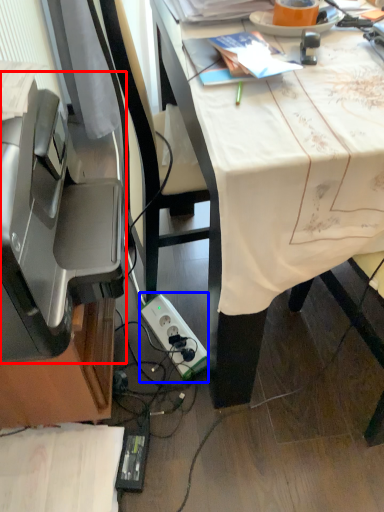
Question: Which object is further to the camera taking this photo, printer (highlighted by a red box) or power plugs and sockets (highlighted by a blue box)?

Choices:
 (A) printer
 (B) power plugs and sockets

Answer: (B)